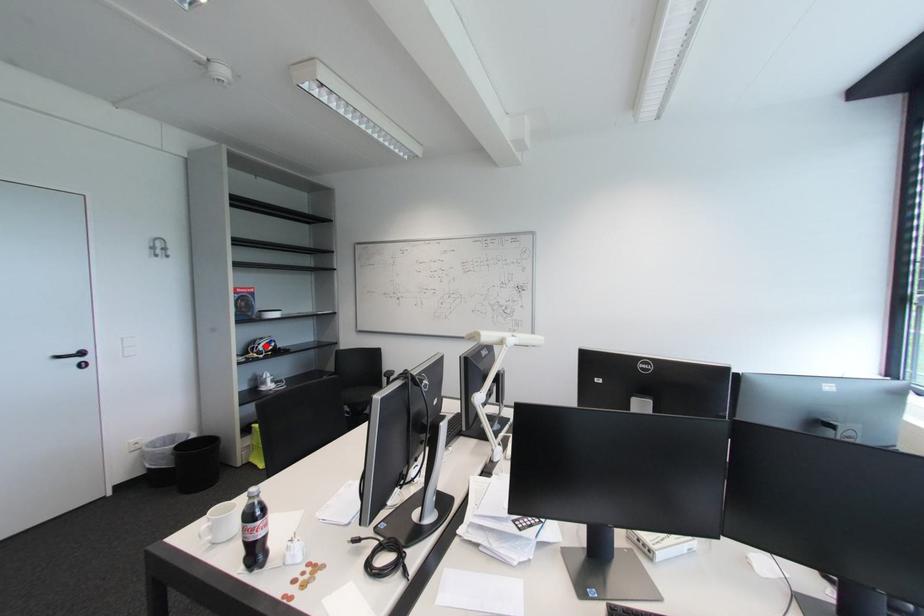
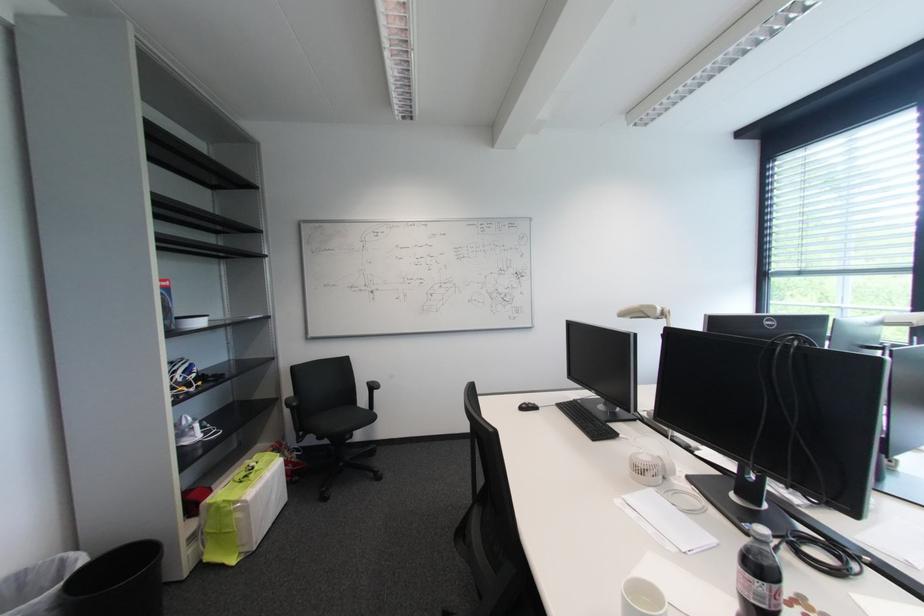
Locate, in the second image, the point that corresponds to the highlighted location in the first image.

(181, 373)